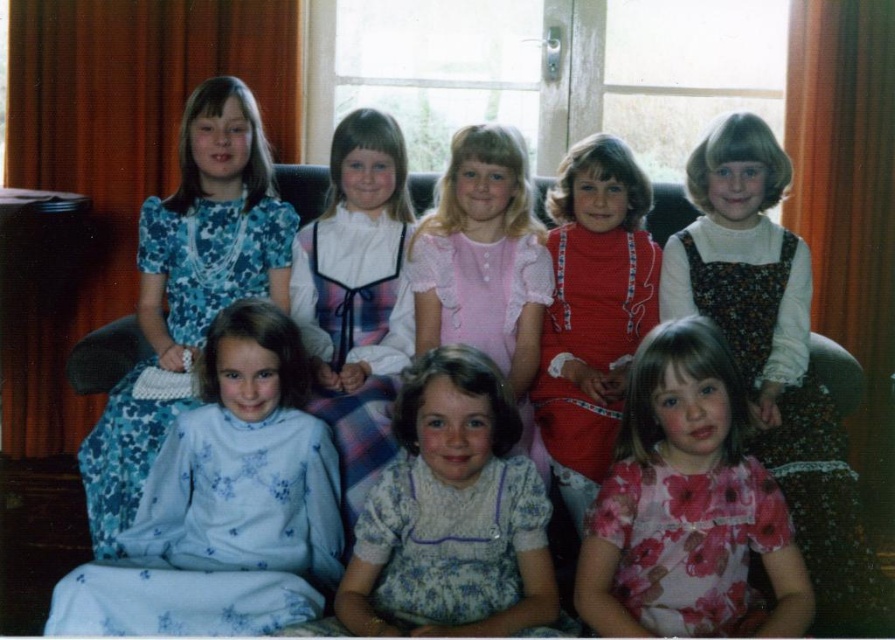
Who is taller, floral pajamas at lower left or floral fabric dress at lower center?

floral pajamas at lower left is taller.

Does floral pajamas at lower left appear over floral fabric dress at lower center?

No, floral pajamas at lower left is not above floral fabric dress at lower center.

Is point (290, 616) more distant than point (743, 611)?

That is False.

You are a GUI agent. You are given a task and a screenshot of the screen. Output one action in this format:
    pyautogui.click(x=<x>, y=<y>)
    Task: Click on the floral pajamas at lower left
    The width and height of the screenshot is (895, 640).
    Given the screenshot: What is the action you would take?
    [226, 502]

Who is taller, floral cotton dress at left or white satin dress at center?

floral cotton dress at left

Which of these two, floral cotton dress at left or white satin dress at center, stands shorter?

Standing shorter between the two is white satin dress at center.

The width and height of the screenshot is (895, 640). In order to click on floral cotton dress at left in this screenshot , I will do `click(212, 256)`.

Can you confirm if floral fabric dress at lower center is taller than red knit dress at center?

No.

Does point (791, 531) come farther from viewer compared to point (590, 244)?

No, it is in front of (590, 244).

The image size is (895, 640). What are the coordinates of `floral fabric dress at lower center` in the screenshot? It's located at (686, 506).